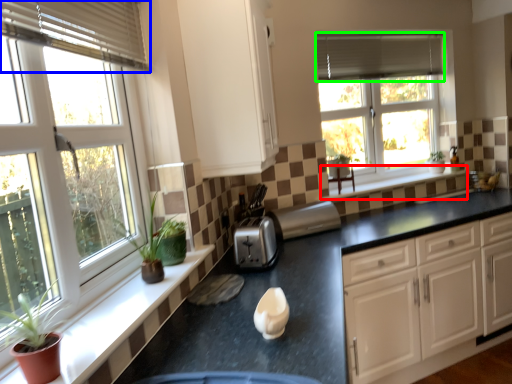
Question: Considering the real-world distances, which object is closest to window sill (highlighted by a red box)? blind (highlighted by a blue box) or blind (highlighted by a green box).

Choices:
 (A) blind
 (B) blind

Answer: (B)